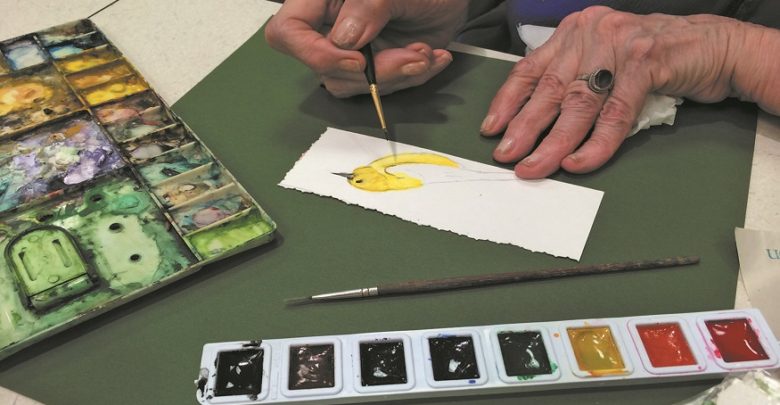
Identify the location of painting. The width and height of the screenshot is (780, 405). (374, 180).